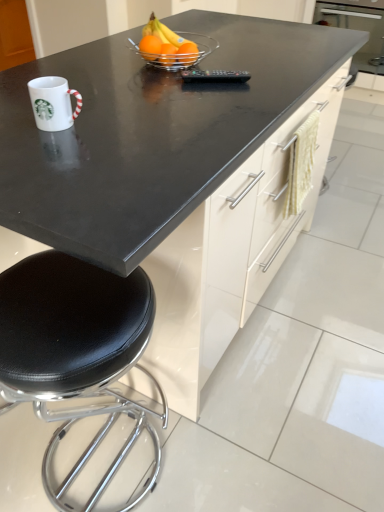
Find the location of `vacant space in between white glossy mug at left and black plastic remote at center`. vacant space in between white glossy mug at left and black plastic remote at center is located at coordinates (157, 98).